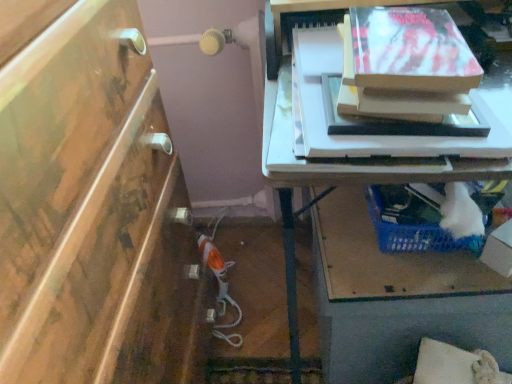
Question: Is white cardboard box at lower right in front of or behind blue plastic basket at lower right in the image?

Choices:
 (A) behind
 (B) front

Answer: (B)

Question: From a real-world perspective, relative to blue plastic basket at lower right, is white cardboard box at lower right vertically above or below?

Choices:
 (A) above
 (B) below

Answer: (A)

Question: Estimate the real-world distances between objects in this image. Which object is farther from the matte cardboard box at upper right?

Choices:
 (A) blue plastic basket at lower right
 (B) white cardboard box at lower right

Answer: (A)

Question: Which object is positioned farthest from the blue plastic basket at lower right?

Choices:
 (A) matte cardboard box at upper right
 (B) white cardboard box at lower right

Answer: (A)